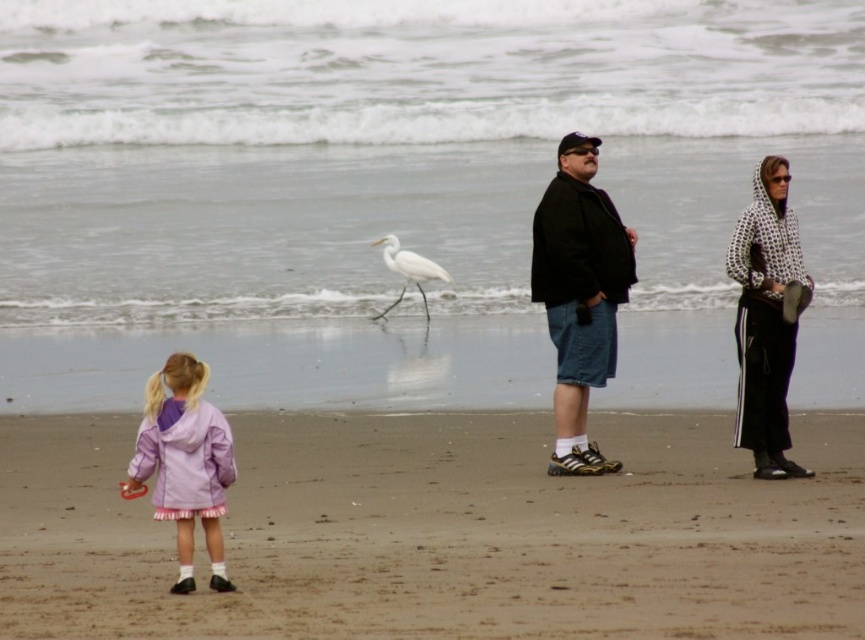
You are standing on the beach and see two points marked on the sand. The first point is at position point (761,205) and the second is at point (415,269). Which point is closer to you?

Point (761,205) is closer to the viewer than point (415,269).

You are standing on the beach and want to place a small seashell on the light brown sand at lower center. However, there is a black matte jacket at center in the way. Can you place the seashell directly on the sand without moving the jacket?

The light brown sand at lower center is positioned under the black matte jacket at center, so you cannot place the seashell directly on the sand without moving the jacket.

You are a photographer standing on the beach. You want to take a photo of the light brown sand at lower center and the white matte bird at center so that both are clearly visible in the frame. Given their distance apart, is it possible to capture both in a single shot without moving your position?

The light brown sand at lower center and white matte bird at center are 35.83 feet apart. Depending on the camera lens, it might be possible to capture both in a single shot if using a wide enough angle. However, without knowing the camera specifications, it is uncertain. But since the question doesn